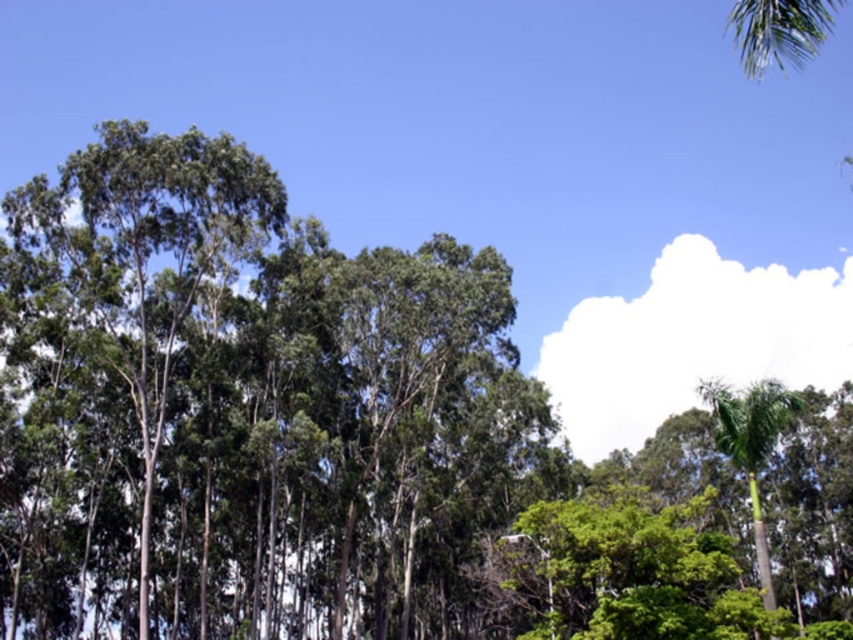
Measure the distance from green leafy trees at center to green leafy palm at right.

green leafy trees at center is 29.36 meters away from green leafy palm at right.

Is point (473, 554) positioned before point (759, 561)?

No, (473, 554) is behind (759, 561).

The width and height of the screenshot is (853, 640). In order to click on green leafy trees at center in this screenshot , I will do `click(248, 410)`.